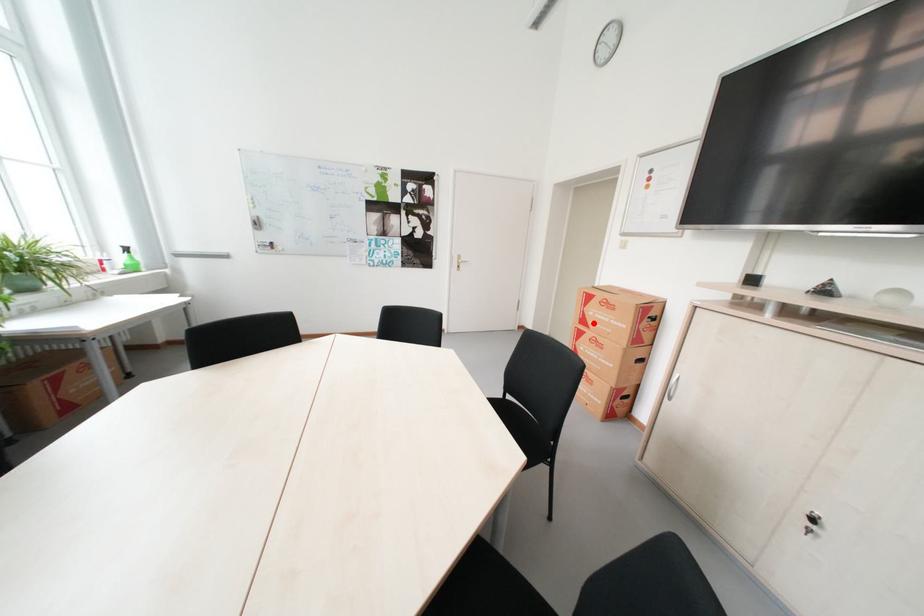
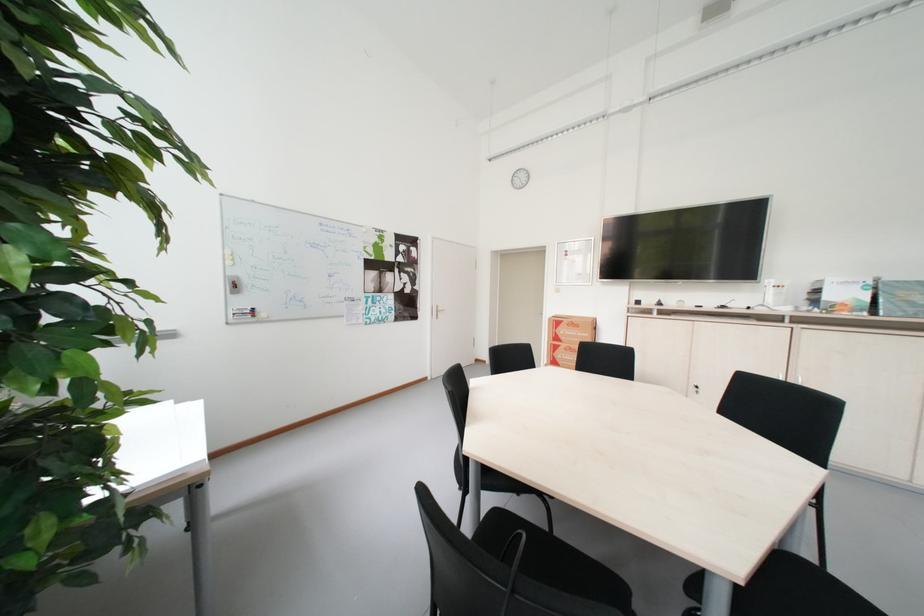
In the second image, find the point that corresponds to the highlighted location in the first image.

(565, 341)